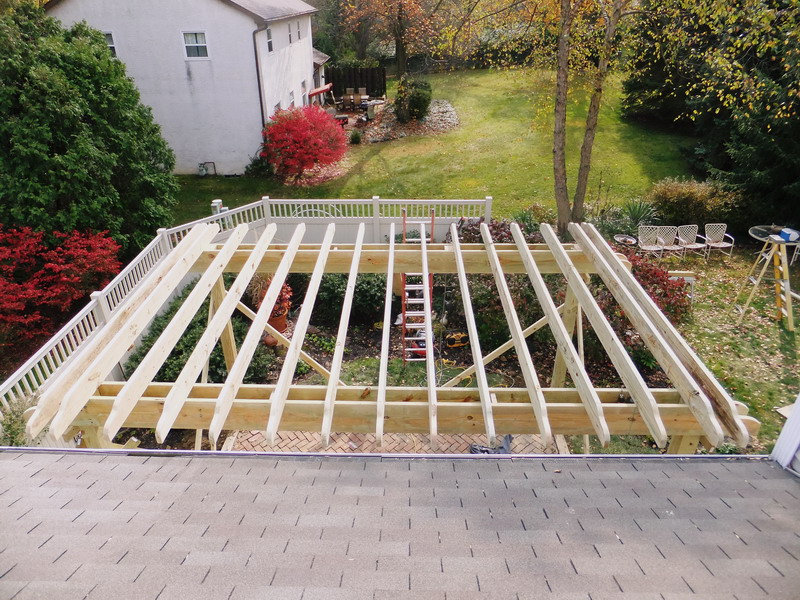
Where is `table`? This screenshot has height=600, width=800. table is located at coordinates (756, 235).